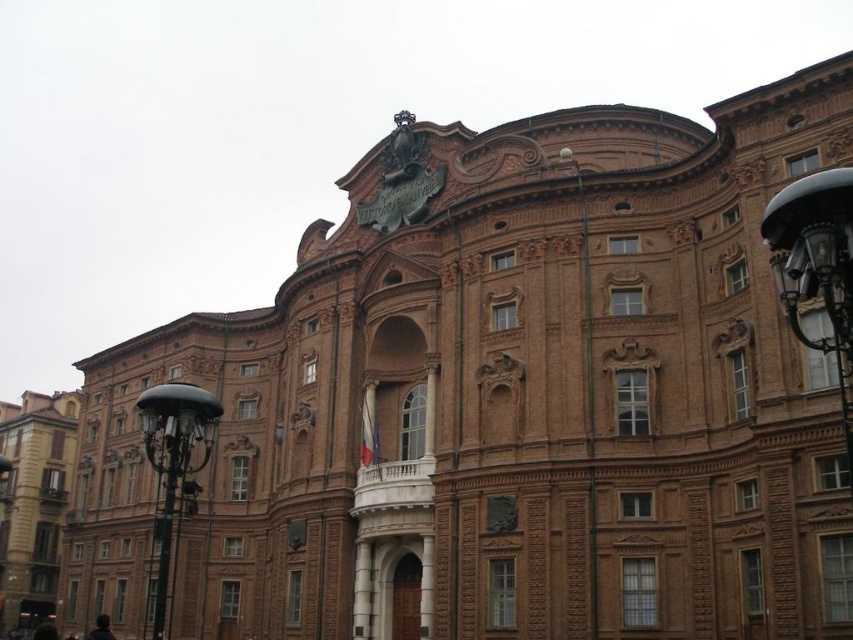
You are standing in front of the grand historic building and want to take a photo of the brown brick building at lower left. Based on its position, where should you aim your camera to capture it in the frame?

The brown brick building at lower left is located at point coordinates approximately 0.786 along the horizontal axis and 0.040 along the vertical axis. To capture it, aim your camera towards the lower left area of the scene, focusing on the coordinates mentioned.

You are standing at the polished black lamp post at left and want to take a photo of the camera. Given that the camera is 145.09 feet away, is the distance within the recommended 150 feet range for clear photos?

The camera is 145.09 feet away from the polished black lamp post at left, which is within the recommended 150 feet range for clear photos.

You are standing in front of the historic building and want to take a photo of the point at coordinates point (28, 566). If your camera has a maximum zoom range of 100 meters, will you be able to capture the point clearly in your photo?

The point at coordinates point (28, 566) is 113.70 meters away from you, which exceeds the camera maximum zoom range of 100 meters. Therefore, you will not be able to capture the point clearly in your photo.